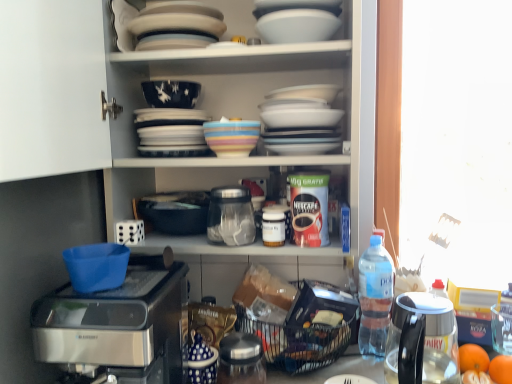
At what (x,y) coordinates should I click in order to perform the action: click on transparent glass jar at center, the second appliance viewed from the top. Please return your answer as a coordinate pair (x, y). This screenshot has height=384, width=512. Looking at the image, I should click on (231, 216).

Measure the distance between transparent glass jar at center, the second appliance viewed from the top, and camera.

transparent glass jar at center, the second appliance viewed from the top, is 39.19 inches away from camera.

What do you see at coordinates (298, 342) in the screenshot? I see `black plastic basket at lower center` at bounding box center [298, 342].

Describe the element at coordinates (231, 137) in the screenshot. I see `multicolored ceramic bowl at upper center, the 2th tableware when ordered from bottom to top` at that location.

The image size is (512, 384). What do you see at coordinates (170, 93) in the screenshot?
I see `dark blue glossy bowl at upper center` at bounding box center [170, 93].

Image resolution: width=512 pixels, height=384 pixels. Identify the location of sleek metallic coffee maker at lower left. (118, 326).

Is white glossy bowl at upper center, positioned as the third tableware in bottom-to-top order, aimed at dark blue glossy bowl at upper center?

No, white glossy bowl at upper center, positioned as the third tableware in bottom-to-top order, is not turned towards dark blue glossy bowl at upper center.

From a real-world perspective, is white glossy bowl at upper center, positioned as the third tableware in bottom-to-top order, below dark blue glossy bowl at upper center?

Incorrect, from a real-world perspective, white glossy bowl at upper center, positioned as the third tableware in bottom-to-top order, is higher than dark blue glossy bowl at upper center.

From the dark blue glossy bowl at upper center, count 2nd tableware to the right and point to it. Please provide its 2D coordinates.

[(297, 25)]

Can you tell me how much white glossy bowl at upper center, positioned as the third tableware in bottom-to-top order, and dark blue glossy bowl at upper center differ in facing direction?

There is a 0.00106-degree angle between the facing directions of white glossy bowl at upper center, positioned as the third tableware in bottom-to-top order, and dark blue glossy bowl at upper center.

From the black plastic basket at lower center, count 1st appliances forward and point to it. Please provide its 2D coordinates.

[(176, 26)]

Considering the sizes of objects porcelain plates at upper center, which is counted as the first appliance, starting from the top, and black plastic basket at lower center in the image provided, who is bigger, porcelain plates at upper center, which is counted as the first appliance, starting from the top, or black plastic basket at lower center?

black plastic basket at lower center is bigger.

How many degrees apart are the facing directions of porcelain plates at upper center, the third appliance when ordered from bottom to top, and black plastic basket at lower center?

They differ by 3.66 degrees in their facing directions.

Based on the photo, can black plastic basket at lower center be found inside porcelain plates at upper center, the third appliance when ordered from bottom to top?

That's incorrect, black plastic basket at lower center is not inside porcelain plates at upper center, the third appliance when ordered from bottom to top.

Is multicolored ceramic bowl at upper center, the 2th tableware when ordered from bottom to top, aimed at white glossy bowl at lower center, the first tableware positioned from the bottom?

No.

Is multicolored ceramic bowl at upper center, which is counted as the second tableware, starting from the top, completely or partially outside of white glossy bowl at lower center, the first tableware positioned from the bottom?

Absolutely, multicolored ceramic bowl at upper center, which is counted as the second tableware, starting from the top, is external to white glossy bowl at lower center, the first tableware positioned from the bottom.

Does point (237, 140) come in front of point (339, 377)?

Yes, point (237, 140) is closer to viewer.

Is multicolored ceramic bowl at upper center, the 2th tableware when ordered from bottom to top, wider than white glossy bowl at lower center, the first tableware positioned from the bottom?

No, multicolored ceramic bowl at upper center, the 2th tableware when ordered from bottom to top, is not wider than white glossy bowl at lower center, the first tableware positioned from the bottom.

Looking at this image, considering the sizes of objects white glossy cabinet at upper center and transparent glass coffee machine at lower right in the image provided, who is bigger, white glossy cabinet at upper center or transparent glass coffee machine at lower right?

Bigger between the two is white glossy cabinet at upper center.

How far apart are white glossy cabinet at upper center and transparent glass coffee machine at lower right?

A distance of 19.68 inches exists between white glossy cabinet at upper center and transparent glass coffee machine at lower right.

In the scene shown: Which is closer to the camera, (52, 372) or (406, 368)?

Point (52, 372) is positioned farther from the camera compared to point (406, 368).

Is white glossy cabinet at upper center further to the viewer compared to transparent glass coffee machine at lower right?

That is False.

From the image's perspective, which is below, sleek metallic coffee maker at lower left or transparent glass jar at center, positioned as the 2th appliance in bottom-to-top order?

sleek metallic coffee maker at lower left appears lower in the image.

Based on the photo, from a real-world perspective, is sleek metallic coffee maker at lower left positioned above or below transparent glass jar at center, the second appliance viewed from the top?

In terms of real-world spatial position, sleek metallic coffee maker at lower left is below transparent glass jar at center, the second appliance viewed from the top.

From the picture: Would you say sleek metallic coffee maker at lower left is to the left or to the right of transparent glass jar at center, positioned as the 2th appliance in bottom-to-top order, in the picture?

Based on their positions, sleek metallic coffee maker at lower left is located to the left of transparent glass jar at center, positioned as the 2th appliance in bottom-to-top order.

Based on the photo, between sleek metallic coffee maker at lower left and orange matte at lower right, which is the first tangerine in front-to-back order, which one has less height?

orange matte at lower right, which is the first tangerine in front-to-back order.

From a real-world perspective, is sleek metallic coffee maker at lower left above or below orange matte at lower right, which is the first tangerine in front-to-back order?

sleek metallic coffee maker at lower left is situated higher than orange matte at lower right, which is the first tangerine in front-to-back order, in the real world.

From the image's perspective, between sleek metallic coffee maker at lower left and orange matte at lower right, which is the first tangerine in front-to-back order, which one is located above?

sleek metallic coffee maker at lower left is shown above in the image.

Is metallic silver jar at lower center, placed as the 1th appliance when sorted from bottom to top, inside the boundaries of clear plastic bottle at right, positioned as the 2th bottle in front-to-back order, or outside?

metallic silver jar at lower center, placed as the 1th appliance when sorted from bottom to top, is not inside clear plastic bottle at right, positioned as the 2th bottle in front-to-back order, it's outside.

Considering the sizes of metallic silver jar at lower center, placed as the 1th appliance when sorted from bottom to top, and clear plastic bottle at right, acting as the first bottle starting from the right, in the image, is metallic silver jar at lower center, placed as the 1th appliance when sorted from bottom to top, taller or shorter than clear plastic bottle at right, acting as the first bottle starting from the right,?

metallic silver jar at lower center, placed as the 1th appliance when sorted from bottom to top, is shorter than clear plastic bottle at right, acting as the first bottle starting from the right.

Considering the points (255, 377) and (364, 296), which point is behind, point (255, 377) or point (364, 296)?

The point (364, 296) is more distant.

Relative to clear plastic bottle at right, positioned as the second bottle in top-to-bottom order, is metallic silver jar at lower center, placed as the 1th appliance when sorted from bottom to top, in front or behind?

metallic silver jar at lower center, placed as the 1th appliance when sorted from bottom to top, is positioned closer to the viewer than clear plastic bottle at right, positioned as the second bottle in top-to-bottom order.

Identify the location of tableware above the dark blue glossy bowl at upper center (from the image's perspective). (297, 25).

Locate an element on the screen. The height and width of the screenshot is (384, 512). basket that appears below the porcelain plates at upper center, which is counted as the first appliance, starting from the top (from the image's perspective) is located at coordinates (298, 342).

Consider the image. Looking at the image, which one is located closer to transparent glass coffee machine at lower right, white glossy bowl at lower center, the first tableware positioned from the bottom, or orange matte at lower right, marked as the 2th tangerine in a back-to-front arrangement?

white glossy bowl at lower center, the first tableware positioned from the bottom.

Looking at the image, which one is located closer to orange matte at lower right, marked as the 2th tangerine in a back-to-front arrangement, transparent glass coffee machine at lower right or white glossy bowl at lower center, the third tableware in the top-to-bottom sequence?

transparent glass coffee machine at lower right.

Based on their spatial positions, is white glossy bowl at upper center, which ranks as the 1th tableware in top-to-bottom order, or multicolored ceramic bowl at upper center, the 2th tableware when ordered from bottom to top, closer to orange matte at lower right, arranged as the 2th tangerine when viewed from the front?

The object closer to orange matte at lower right, arranged as the 2th tangerine when viewed from the front, is multicolored ceramic bowl at upper center, the 2th tableware when ordered from bottom to top.

Which object lies nearer to the anchor point metallic silver jar at lower center, positioned as the third appliance in top-to-bottom order, transparent glass coffee machine at lower right or white glossy bowl at lower center, the third tableware in the top-to-bottom sequence?

The object closer to metallic silver jar at lower center, positioned as the third appliance in top-to-bottom order, is white glossy bowl at lower center, the third tableware in the top-to-bottom sequence.

From the image, which object appears to be nearer to sleek metallic coffee maker at lower left, orange matte at lower right, the first tangerine positioned from the back, or transparent glass jar at center, positioned as the 2th appliance in bottom-to-top order?

Among the two, transparent glass jar at center, positioned as the 2th appliance in bottom-to-top order, is located nearer to sleek metallic coffee maker at lower left.

Which object lies nearer to the anchor point multicolored ceramic bowl at upper center, which is counted as the second tableware, starting from the top, white glossy bowl at upper center, positioned as the third tableware in bottom-to-top order, or white glossy cabinet at upper center?

white glossy bowl at upper center, positioned as the third tableware in bottom-to-top order.

Which object lies further to the anchor point orange matte at lower right, which is the first tangerine in front-to-back order, white glossy cabinet at upper center or multicolored ceramic bowl at upper center, which is counted as the second tableware, starting from the top?

white glossy cabinet at upper center lies further to orange matte at lower right, which is the first tangerine in front-to-back order, than the other object.

From the image, which object appears to be farther from orange matte at lower right, the first tangerine positioned from the back, metallic silver jar at lower center, placed as the 1th appliance when sorted from bottom to top, or multicolored ceramic bowl at upper center, which is counted as the second tableware, starting from the top?

multicolored ceramic bowl at upper center, which is counted as the second tableware, starting from the top, lies further to orange matte at lower right, the first tangerine positioned from the back, than the other object.

Find the location of a particular element. coffee maker between white glossy bowl at upper center, which ranks as the 1th tableware in top-to-bottom order, and white glossy bowl at lower center, the first tableware positioned from the bottom, vertically is located at coordinates (118, 326).

Locate an element on the screen. coffee maker that lies between white glossy bowl at upper center, which ranks as the 1th tableware in top-to-bottom order, and black plastic basket at lower center from top to bottom is located at coordinates (118, 326).

The width and height of the screenshot is (512, 384). Identify the location of coffee machine between white glossy cabinet at upper center and white glossy bowl at lower center, the third tableware in the top-to-bottom sequence, in the vertical direction. (421, 341).

Where is `bowl between porcelain plates at upper center, which is counted as the first appliance, starting from the top, and transparent glass coffee machine at lower right, in the vertical direction`? bowl between porcelain plates at upper center, which is counted as the first appliance, starting from the top, and transparent glass coffee machine at lower right, in the vertical direction is located at coordinates pos(170,93).